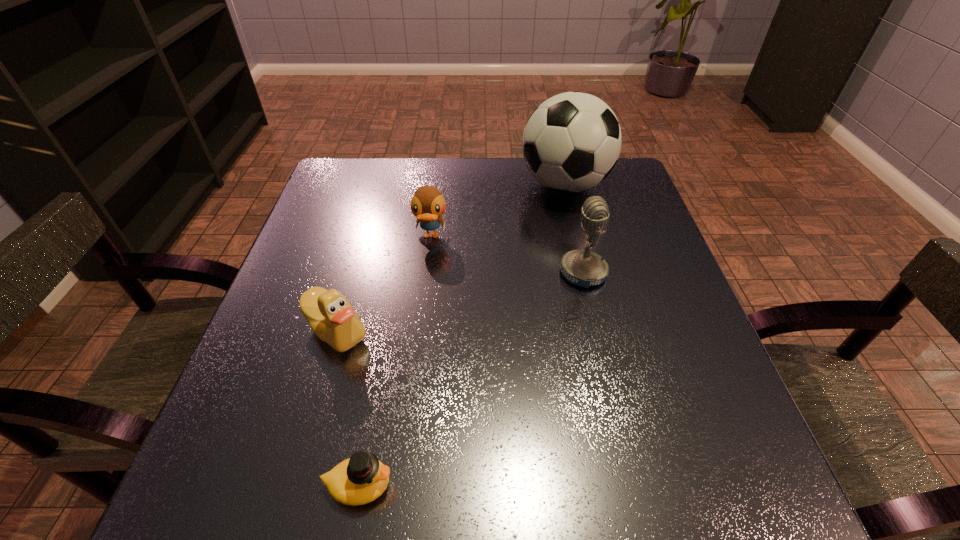
Where is `vacant space located 0.270m on the front-facing side of the second tallest object`? vacant space located 0.270m on the front-facing side of the second tallest object is located at coordinates (433, 273).

This screenshot has width=960, height=540. In order to click on free point located on the front-facing side of the second tallest object in this screenshot , I will do `click(387, 273)`.

You are a GUI agent. You are given a task and a screenshot of the screen. Output one action in this format:
    pyautogui.click(x=<x>, y=<y>)
    Task: Click on the vacant region located on the front-facing side of the farthest duck
    
    Given the screenshot: What is the action you would take?
    pyautogui.click(x=421, y=314)

The width and height of the screenshot is (960, 540). What are the coordinates of `free space located 0.240m at the beak of the fourth farthest object` in the screenshot? It's located at (287, 502).

The width and height of the screenshot is (960, 540). I want to click on vacant space situated on the front-facing side of the nearest object, so click(616, 485).

You are a GUI agent. You are given a task and a screenshot of the screen. Output one action in this format:
    pyautogui.click(x=<x>, y=<y>)
    Task: Click on the object at the far edge
    The height and width of the screenshot is (540, 960).
    Given the screenshot: What is the action you would take?
    pyautogui.click(x=572, y=141)

Where is `object situated at the near edge`? The height and width of the screenshot is (540, 960). object situated at the near edge is located at coordinates (361, 479).

Image resolution: width=960 pixels, height=540 pixels. In order to click on object positioned at the left edge in this screenshot , I will do `click(331, 317)`.

This screenshot has width=960, height=540. In order to click on soccer ball that is at the right edge in this screenshot , I will do `click(572, 141)`.

The width and height of the screenshot is (960, 540). What are the coordinates of `microphone that is at the right edge` in the screenshot? It's located at (584, 268).